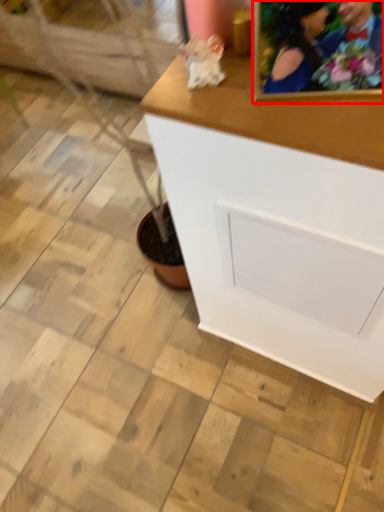
Question: Considering the relative positions of picture frame (annotated by the red box) and table in the image provided, where is picture frame (annotated by the red box) located with respect to the staircase?

Choices:
 (A) left
 (B) right

Answer: (A)